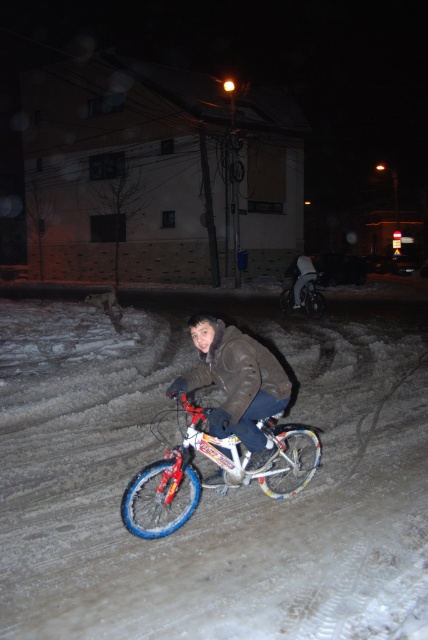
Question: Does shiny metallic bicycle at center have a greater width compared to brown fuzzy jacket at center?

Choices:
 (A) no
 (B) yes

Answer: (B)

Question: Among these objects, which one is nearest to the camera?

Choices:
 (A) shiny metallic bicycle at center
 (B) brown fuzzy jacket at center

Answer: (B)

Question: Which is nearer to the metallic silver bicycle at center?

Choices:
 (A) shiny metallic bicycle at center
 (B) white powdery snow at center
 (C) matte black jacket at center
 (D) brown fuzzy jacket at center

Answer: (C)

Question: Is white powdery snow at center to the right of brown fuzzy jacket at center from the viewer's perspective?

Choices:
 (A) yes
 (B) no

Answer: (B)

Question: Which object is the closest to the metallic silver bicycle at center?

Choices:
 (A) brown fuzzy jacket at center
 (B) shiny metallic bicycle at center
 (C) matte black jacket at center
 (D) white powdery snow at center

Answer: (C)

Question: Is white powdery snow at center bigger than metallic silver bicycle at center?

Choices:
 (A) yes
 (B) no

Answer: (A)